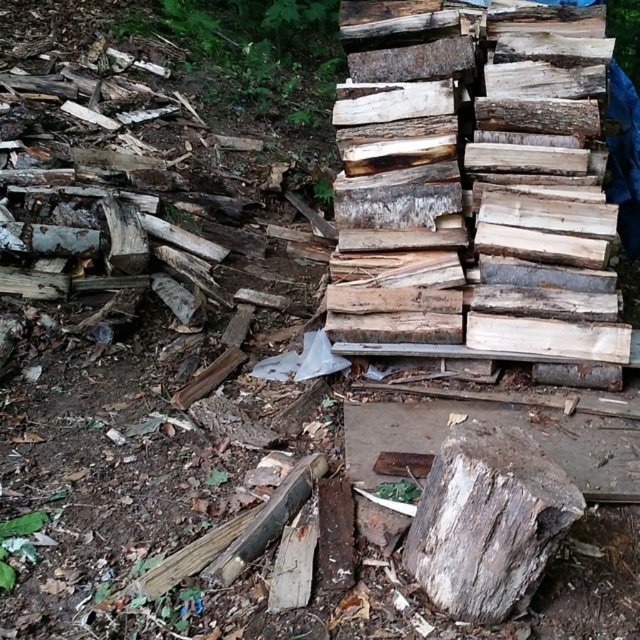
Question: Does weathered wood at upper right appear on the left side of weathered wood stump at center?

Choices:
 (A) yes
 (B) no

Answer: (B)

Question: Among these points, which one is farthest from the camera?

Choices:
 (A) (464, 72)
 (B) (451, 497)

Answer: (A)

Question: Is weathered wood at upper right smaller than weathered wood stump at center?

Choices:
 (A) no
 (B) yes

Answer: (A)

Question: In this image, where is weathered wood at upper right located relative to weathered wood stump at center?

Choices:
 (A) left
 (B) right

Answer: (B)

Question: Which point is farther from the camera taking this photo?

Choices:
 (A) (436, 548)
 (B) (545, 234)

Answer: (B)